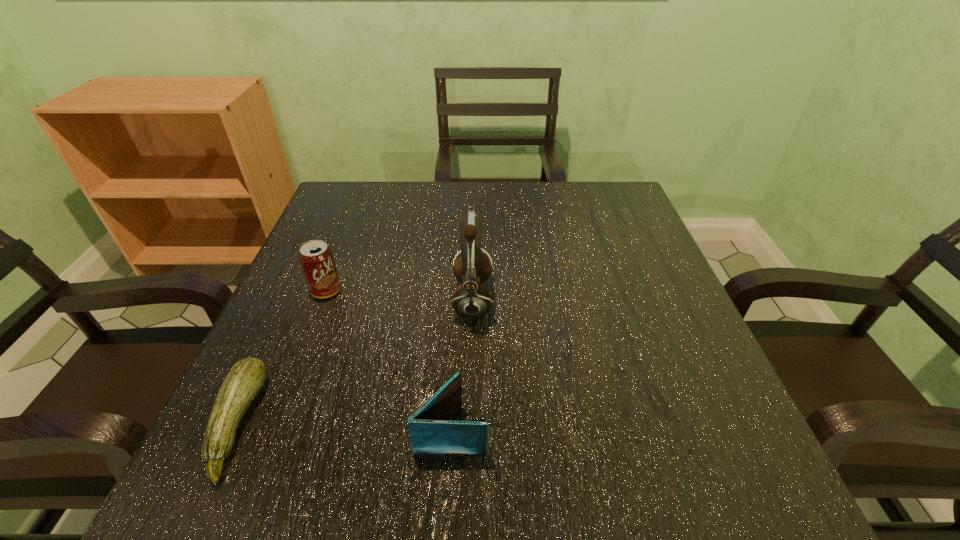
Locate an element on the screen. Image resolution: width=960 pixels, height=540 pixels. wallet present at the near edge is located at coordinates (432, 434).

Image resolution: width=960 pixels, height=540 pixels. Identify the location of zucchini located in the near edge section of the desktop. (245, 379).

At what (x,y) coordinates should I click in order to perform the action: click on soda can at the left edge. Please return your answer as a coordinate pair (x, y). The image size is (960, 540). Looking at the image, I should click on (316, 258).

Where is `zucchini positioned at the left edge`? This screenshot has height=540, width=960. zucchini positioned at the left edge is located at coordinates (245, 379).

Locate an element on the screen. object that is at the near left corner is located at coordinates (245, 379).

The height and width of the screenshot is (540, 960). In the image, there is a desktop. Identify the location of vacant space at the far edge. (409, 208).

What are the coordinates of `vacant area at the near edge of the desktop` in the screenshot? It's located at (463, 497).

At what (x,y) coordinates should I click in order to perform the action: click on vacant area at the left edge of the desktop. Please return your answer as a coordinate pair (x, y). The width and height of the screenshot is (960, 540). Looking at the image, I should click on (362, 237).

Image resolution: width=960 pixels, height=540 pixels. In the image, there is a desktop. Find the location of `vacant space at the right edge`. vacant space at the right edge is located at coordinates (668, 300).

In the image, there is a desktop. Identify the location of free space at the far left corner. Image resolution: width=960 pixels, height=540 pixels. (325, 220).